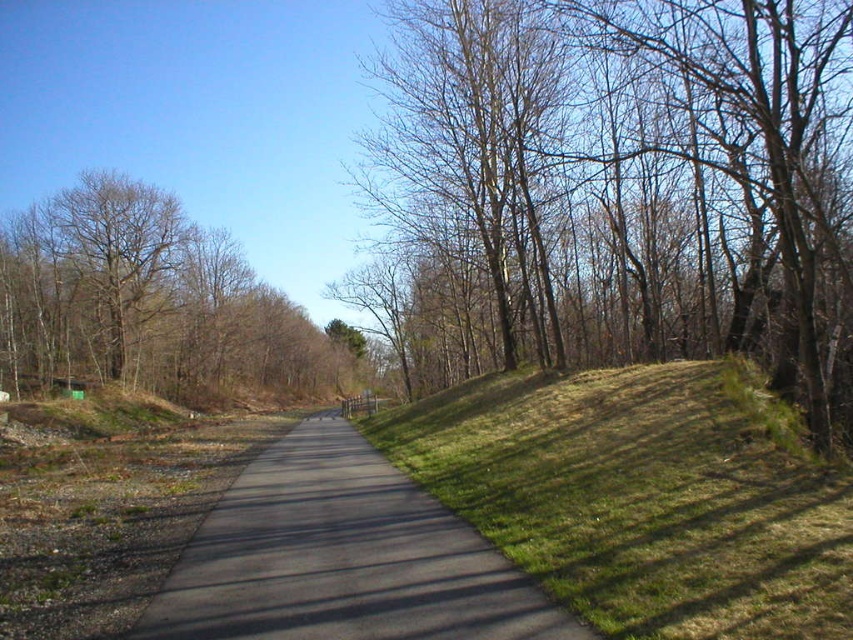
In the scene shown: You are a hiker planning to walk along the black asphalt path at center. You want to stay as close to the green grassy hillside at right as possible. Which side of the path should you walk on?

The green grassy hillside at right is positioned on the right side of the black asphalt path at center, so you should walk on the right side of the path to stay as close as possible to the green grassy hillside at right.

You are standing at the starting point of the pathway and want to reach the green grassy hillside at right located at point [640,499]. What direction should you walk to reach it?

To reach the green grassy hillside at right located at point [640,499], you should walk towards the right side of the pathway since the green grassy hillside at right is situated on the right side of the path.